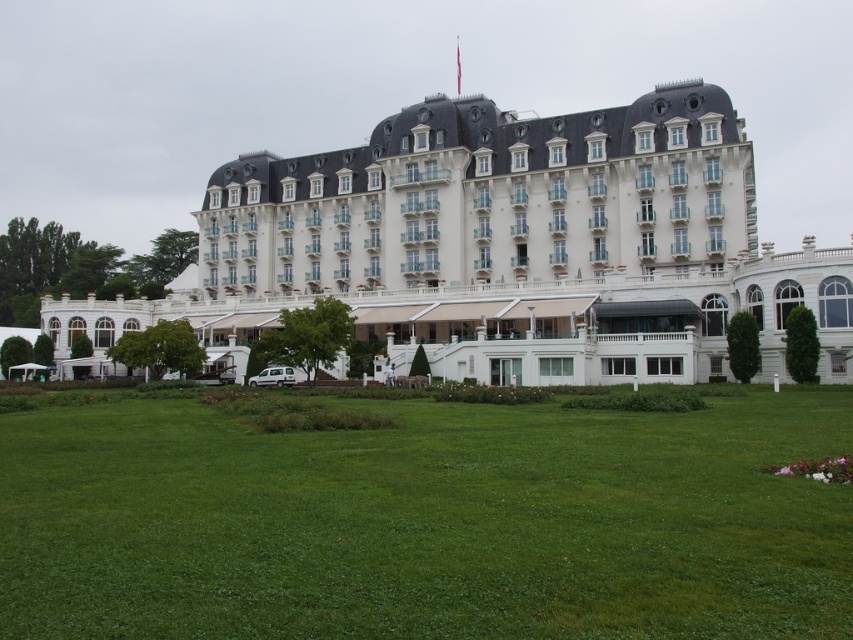
You are standing in front of the grand building and want to take a photo. You notice two points marked on the lawn. The first point is at coordinate point [486,541] and the second is at point [613,156]. If you want to capture both points in your photo, which point should you focus on to ensure both are in frame?

You should focus on point [613,156] because it is farther from the camera than point [486,541], so by focusing on the farther point, both points will be within the frame.